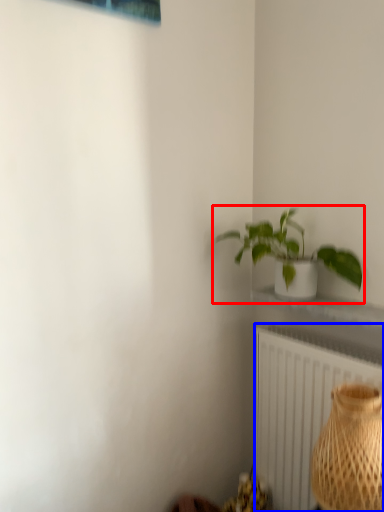
Question: Which object is closer to the camera taking this photo, houseplant (highlighted by a red box) or radiator (highlighted by a blue box)?

Choices:
 (A) houseplant
 (B) radiator

Answer: (A)